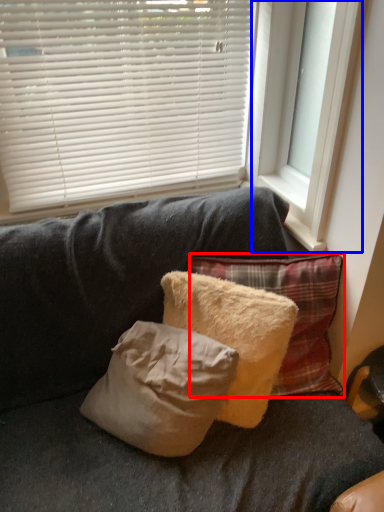
Question: Which point is closer to the camera, pillow (highlighted by a red box) or window frame (highlighted by a blue box)?

Choices:
 (A) pillow
 (B) window frame

Answer: (B)